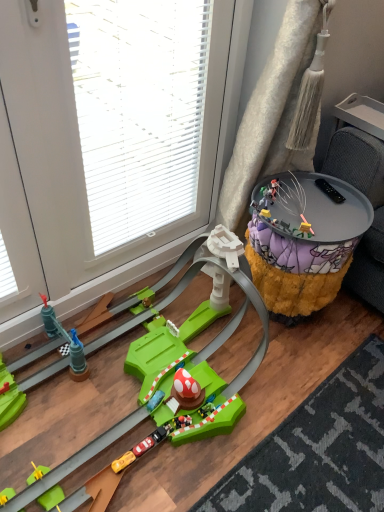
Describe the element at coordinates (304, 244) in the screenshot. I see `shaggy yellow ottoman at right` at that location.

Measure the distance between point (172, 53) and camera.

Point (172, 53) and camera are 4.20 feet apart.

Locate an element on the screen. The width and height of the screenshot is (384, 512). shaggy yellow ottoman at right is located at coordinates (304, 244).

Which point is more distant from viewer, (168, 29) or (266, 329)?

Positioned behind is point (266, 329).

From the image's perspective, does transparent plastic glass door at upper left appear lower than green plastic race track at lower left, arranged as the 1th toy when ordered from the bottom?

Actually, transparent plastic glass door at upper left appears above green plastic race track at lower left, arranged as the 1th toy when ordered from the bottom, in the image.

Considering the sizes of shaggy yellow ottoman at right and green plastic race track at lower left, the 1th toy positioned from the front, in the image, is shaggy yellow ottoman at right taller or shorter than green plastic race track at lower left, the 1th toy positioned from the front,?

shaggy yellow ottoman at right is taller than green plastic race track at lower left, the 1th toy positioned from the front.

Is shaggy yellow ottoman at right located outside green plastic race track at lower left, the first toy in the left-to-right sequence?

That's correct, shaggy yellow ottoman at right is outside of green plastic race track at lower left, the first toy in the left-to-right sequence.

From a real-world perspective, who is located higher, shaggy yellow ottoman at right or green plastic race track at lower left, the first toy in the left-to-right sequence?

shaggy yellow ottoman at right.

From the image's perspective, does shaggy yellow ottoman at right appear higher than transparent plastic glass door at upper left?

No, from the image's perspective, shaggy yellow ottoman at right is not on top of transparent plastic glass door at upper left.

You are a GUI agent. You are given a task and a screenshot of the screen. Output one action in this format:
    pyautogui.click(x=<x>, y=<y>)
    Task: Click on the glass door that is in front of the shaggy yellow ottoman at right
    This screenshot has height=512, width=384.
    Given the screenshot: What is the action you would take?
    (108, 142)

Between shaggy yellow ottoman at right and transparent plastic glass door at upper left, which one has less height?

shaggy yellow ottoman at right is shorter.

From a real-world perspective, is shaggy yellow ottoman at right above or below transparent plastic glass door at upper left?

Clearly, from a real-world perspective, shaggy yellow ottoman at right is below transparent plastic glass door at upper left.

Considering the positions of objects transparent plastic glass door at upper left and shaggy yellow ottoman at right in the image provided, who is in front, transparent plastic glass door at upper left or shaggy yellow ottoman at right?

transparent plastic glass door at upper left is closer to the camera.

Find the location of a particular element. glass door located in front of the shaggy yellow ottoman at right is located at coordinates (108, 142).

Are transparent plastic glass door at upper left and shaggy yellow ottoman at right located far from each other?

No, transparent plastic glass door at upper left is not far away from shaggy yellow ottoman at right.

Does transparent plastic glass door at upper left contain shaggy yellow ottoman at right?

Actually, shaggy yellow ottoman at right is outside transparent plastic glass door at upper left.

At what (x,y) coordinates should I click in order to perform the action: click on the 1st toy to the left of the shaggy yellow ottoman at right, counting from the anchor's position. Please return your answer as a coordinate pair (x, y). Image resolution: width=384 pixels, height=512 pixels. Looking at the image, I should click on (303, 218).

Is metallic gold figure at center-right, placed as the second toy when sorted from bottom to top, taller than shaggy yellow ottoman at right?

No, metallic gold figure at center-right, placed as the second toy when sorted from bottom to top, is not taller than shaggy yellow ottoman at right.

Could you tell me if metallic gold figure at center-right, the second toy positioned from the front, is turned towards green plastic race track at lower left, the 2th toy viewed from the top?

No, metallic gold figure at center-right, the second toy positioned from the front, does not turn towards green plastic race track at lower left, the 2th toy viewed from the top.

Consider the image. How distant is metallic gold figure at center-right, the second toy positioned from the front, from green plastic race track at lower left, the 2th toy viewed from the top?

metallic gold figure at center-right, the second toy positioned from the front, is 19.45 inches from green plastic race track at lower left, the 2th toy viewed from the top.

Considering the relative positions of metallic gold figure at center-right, acting as the 1th toy starting from the top, and green plastic race track at lower left, arranged as the 1th toy when ordered from the bottom, in the image provided, is metallic gold figure at center-right, acting as the 1th toy starting from the top, to the left of green plastic race track at lower left, arranged as the 1th toy when ordered from the bottom, from the viewer's perspective?

No, metallic gold figure at center-right, acting as the 1th toy starting from the top, is not to the left of green plastic race track at lower left, arranged as the 1th toy when ordered from the bottom.

Considering their positions, is metallic gold figure at center-right, arranged as the 1th toy when viewed from the right, located in front of or behind green plastic race track at lower left, the first toy in the left-to-right sequence?

Clearly, metallic gold figure at center-right, arranged as the 1th toy when viewed from the right, is behind green plastic race track at lower left, the first toy in the left-to-right sequence.

Considering the sizes of objects metallic gold figure at center-right, the 2th toy when ordered from left to right, and transparent plastic glass door at upper left in the image provided, who is shorter, metallic gold figure at center-right, the 2th toy when ordered from left to right, or transparent plastic glass door at upper left?

Standing shorter between the two is metallic gold figure at center-right, the 2th toy when ordered from left to right.

How distant is metallic gold figure at center-right, placed as the second toy when sorted from bottom to top, from transparent plastic glass door at upper left?

metallic gold figure at center-right, placed as the second toy when sorted from bottom to top, is 71.04 centimeters away from transparent plastic glass door at upper left.

Is metallic gold figure at center-right, the 2th toy when ordered from left to right, facing away from transparent plastic glass door at upper left?

Yes, metallic gold figure at center-right, the 2th toy when ordered from left to right,'s orientation is away from transparent plastic glass door at upper left.

Considering the points (305, 220) and (214, 192), which point is in front, point (305, 220) or point (214, 192)?

Point (305, 220)

Locate an element on the screen. This screenshot has height=512, width=384. glass door above the green plastic race track at lower left, which appears as the second toy when viewed from the back (from a real-world perspective) is located at coordinates (108, 142).

Identify the location of table on the right side of green plastic race track at lower left, arranged as the 1th toy when ordered from the bottom. Image resolution: width=384 pixels, height=512 pixels. (304, 244).

Looking at the image, which one is located further to metallic gold figure at center-right, the 2th toy when ordered from left to right, transparent plastic glass door at upper left or green plastic race track at lower left, which appears as the second toy when viewed from the back?

Among the two, transparent plastic glass door at upper left is located further to metallic gold figure at center-right, the 2th toy when ordered from left to right.

When comparing their distances from green plastic race track at lower left, the 1th toy positioned from the front, does transparent plastic glass door at upper left or shaggy yellow ottoman at right seem further?

transparent plastic glass door at upper left is further to green plastic race track at lower left, the 1th toy positioned from the front.

When comparing their distances from green plastic race track at lower left, the second toy in the right-to-left sequence, does shaggy yellow ottoman at right or transparent plastic glass door at upper left seem closer?

shaggy yellow ottoman at right.

Looking at the image, which one is located closer to shaggy yellow ottoman at right, green plastic race track at lower left, which appears as the second toy when viewed from the back, or transparent plastic glass door at upper left?

green plastic race track at lower left, which appears as the second toy when viewed from the back, is closer to shaggy yellow ottoman at right.

Looking at the image, which one is located further to transparent plastic glass door at upper left, shaggy yellow ottoman at right or green plastic race track at lower left, arranged as the 1th toy when ordered from the bottom?

shaggy yellow ottoman at right is further to transparent plastic glass door at upper left.

Consider the image. From the image, which object appears to be farther from metallic gold figure at center-right, arranged as the 1th toy when viewed from the right, shaggy yellow ottoman at right or transparent plastic glass door at upper left?

Based on the image, transparent plastic glass door at upper left appears to be further to metallic gold figure at center-right, arranged as the 1th toy when viewed from the right.

From the image, which object appears to be farther from shaggy yellow ottoman at right, metallic gold figure at center-right, placed as the second toy when sorted from bottom to top, or transparent plastic glass door at upper left?

Among the two, transparent plastic glass door at upper left is located further to shaggy yellow ottoman at right.

Considering their positions, is metallic gold figure at center-right, placed as the second toy when sorted from bottom to top, positioned further to transparent plastic glass door at upper left than green plastic race track at lower left, the second toy in the right-to-left sequence?

metallic gold figure at center-right, placed as the second toy when sorted from bottom to top, is positioned further to the anchor transparent plastic glass door at upper left.

Find the location of a particular element. The image size is (384, 512). toy between green plastic race track at lower left, arranged as the 1th toy when ordered from the bottom, and shaggy yellow ottoman at right is located at coordinates (303, 218).

The width and height of the screenshot is (384, 512). Find the location of `toy located between transparent plastic glass door at upper left and metallic gold figure at center-right, acting as the 1th toy starting from the top, in the left-right direction`. toy located between transparent plastic glass door at upper left and metallic gold figure at center-right, acting as the 1th toy starting from the top, in the left-right direction is located at coordinates (232, 318).